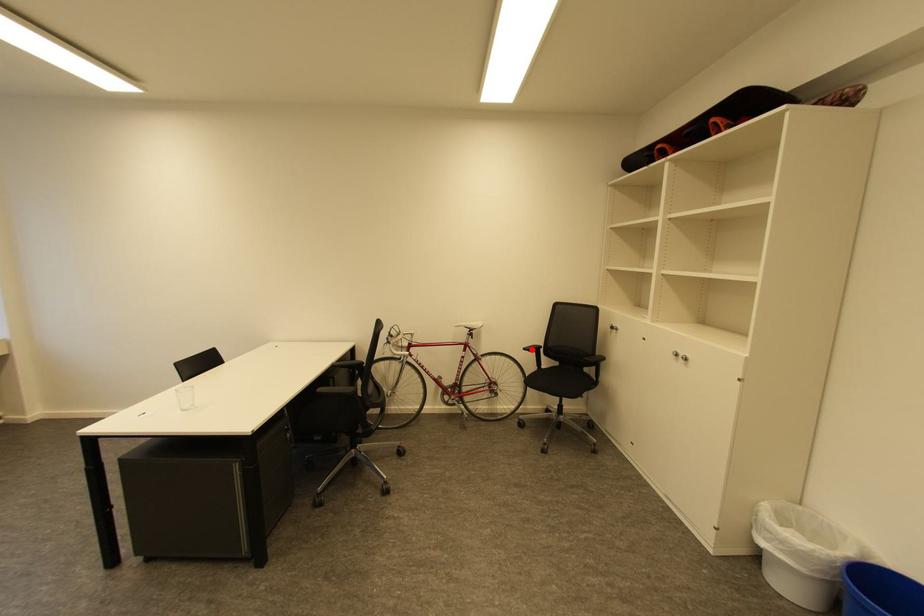
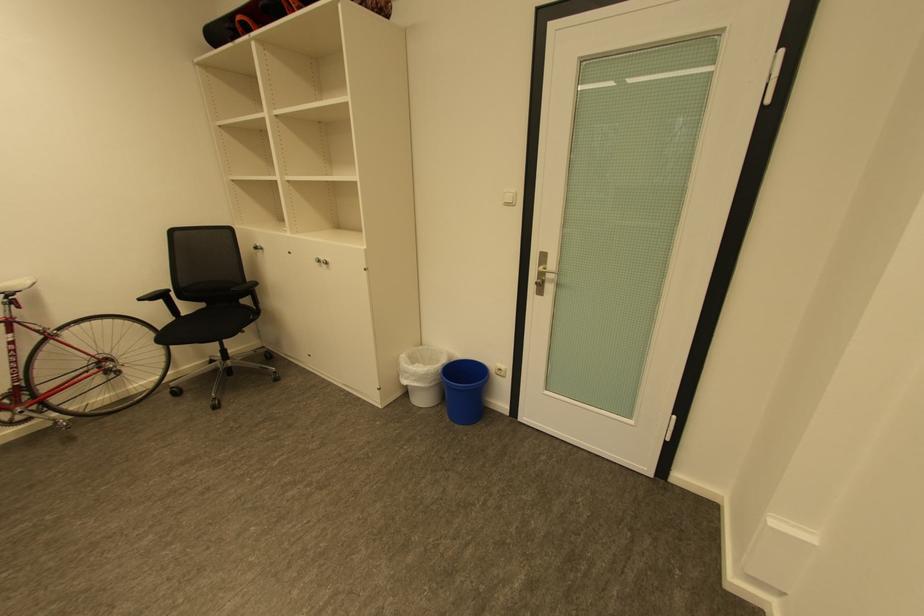
Where in the second image is the point corresponding to the highlighted location from the first image?

(148, 300)